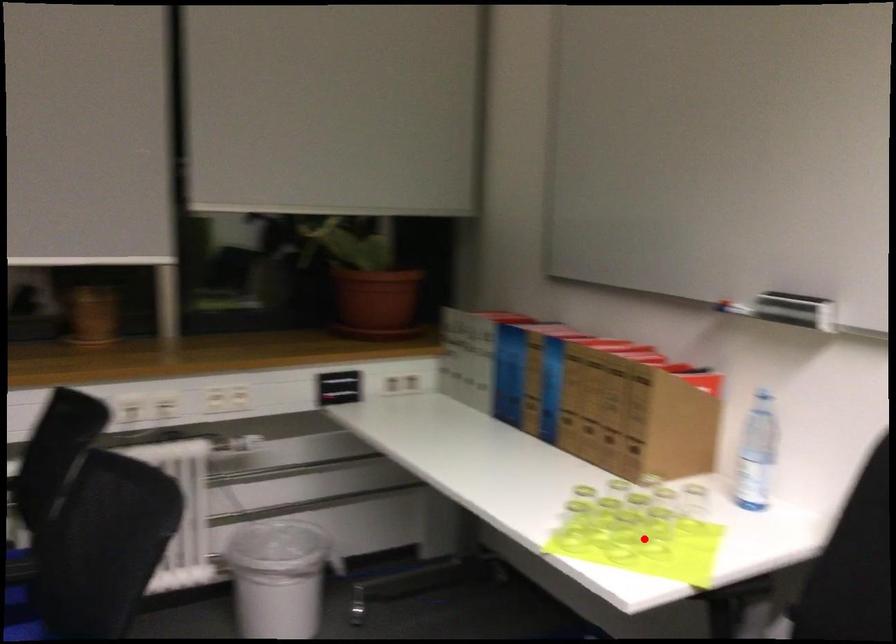
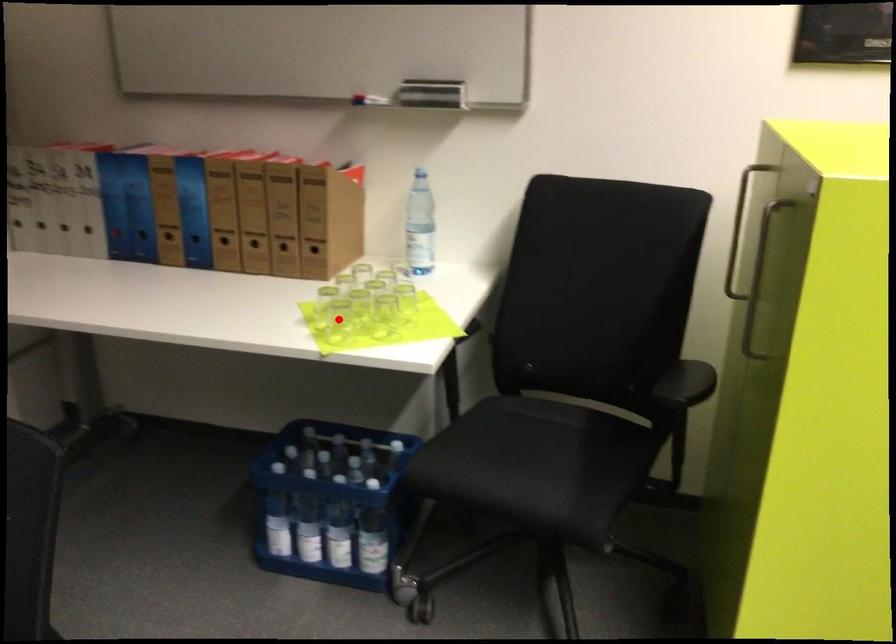
I am providing you with two images of the same scene from different viewpoints. A red point is marked on the first image and another point is marked on the second image. Does the point marked in image1 correspond to the same location as the one in image2?

No